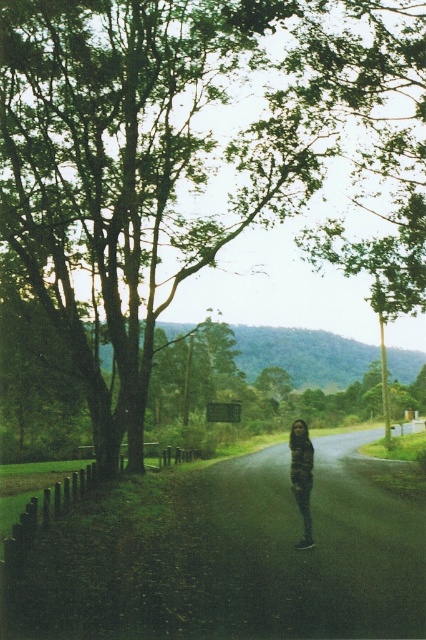
Who is higher up, green leafy tree at center or dark brown leather jacket at center?

green leafy tree at center is above.

The width and height of the screenshot is (426, 640). Identify the location of green leafy tree at center. (198, 157).

Between green leafy tree at center and dark asphalt road at center, which one is positioned lower?

dark asphalt road at center is below.

Does point (371, 32) lie in front of point (72, 509)?

No, it is not.

Is point (368, 189) farther from viewer compared to point (385, 561)?

Yes.

The image size is (426, 640). I want to click on green leafy tree at center, so click(x=198, y=157).

In the scene shown: Is dark asphalt road at center thinner than dark brown leather jacket at center?

No, dark asphalt road at center is not thinner than dark brown leather jacket at center.

Is dark asphalt road at center smaller than dark brown leather jacket at center?

No.

Is point (423, 573) closer to viewer compared to point (293, 440)?

Yes, it is in front of point (293, 440).

This screenshot has height=640, width=426. In order to click on dark asphalt road at center in this screenshot , I will do `click(230, 556)`.